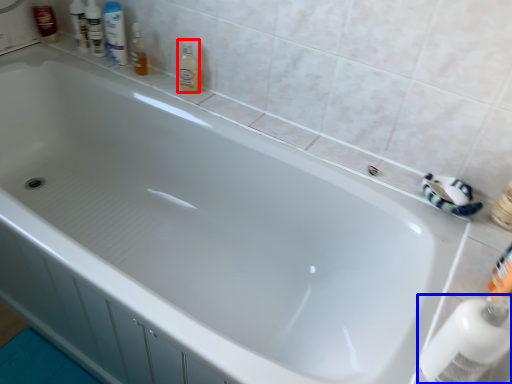
Question: Which of the following is the farthest to the observer, cleaning product (highlighted by a red box) or cleaning product (highlighted by a blue box)?

Choices:
 (A) cleaning product
 (B) cleaning product

Answer: (A)